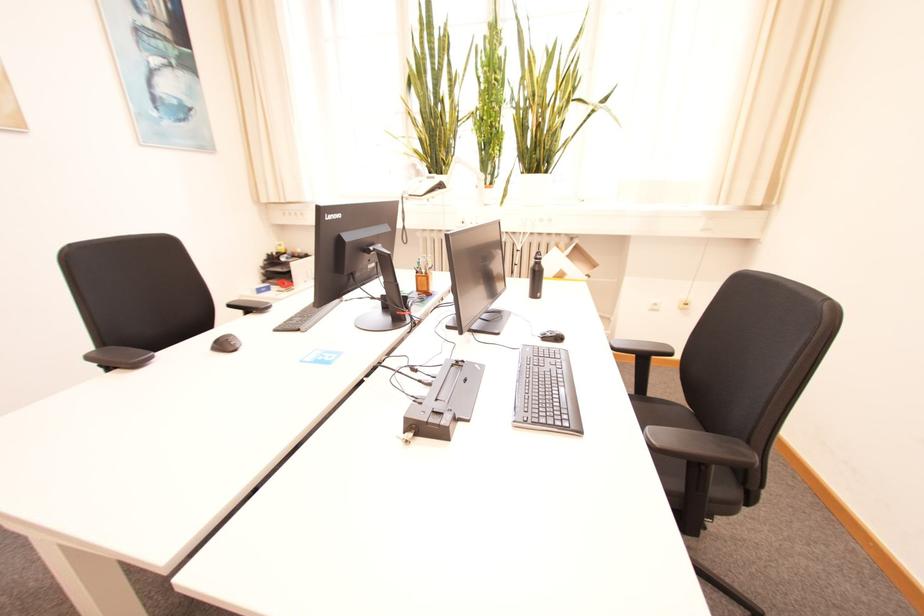
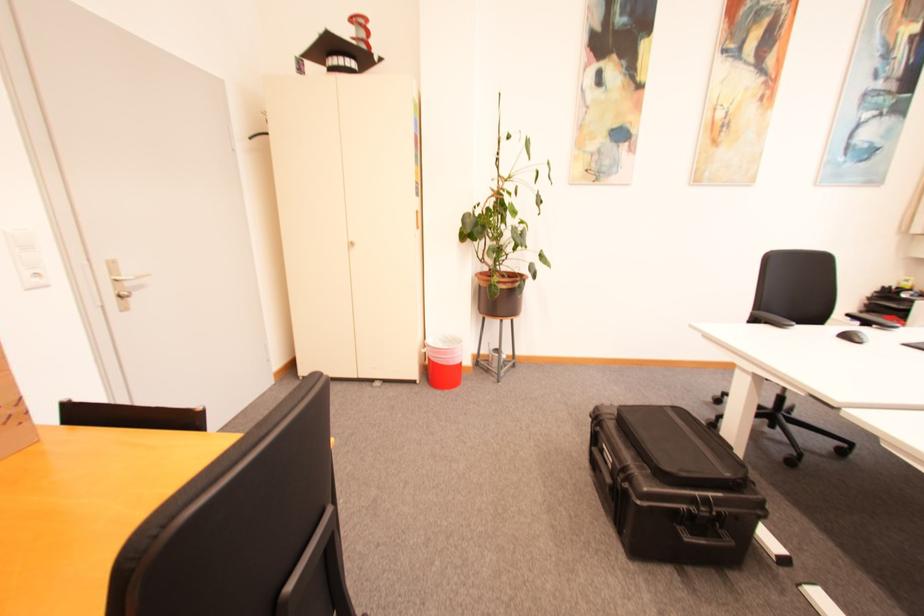
Locate, in the second image, the point that corresponds to (x=237, y=350) in the first image.

(865, 342)